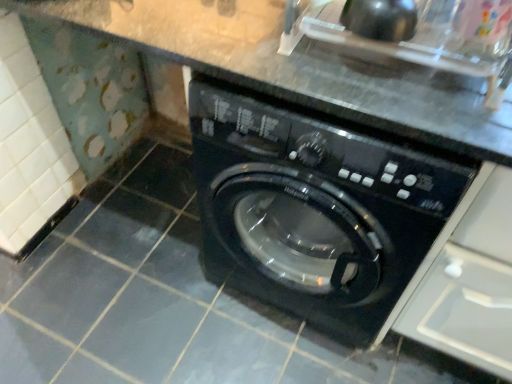
This screenshot has width=512, height=384. What do you see at coordinates (422, 39) in the screenshot? I see `black glossy sink at upper right` at bounding box center [422, 39].

Identify the location of white plastic drawer at upper right. (470, 285).

The width and height of the screenshot is (512, 384). Find the location of `black glossy sink at upper right`. black glossy sink at upper right is located at coordinates (422, 39).

Is point (237, 180) less distant than point (495, 204)?

No, (237, 180) is behind (495, 204).

Which object is positioned more to the left, black glossy washing machine at center or white plastic drawer at upper right?

black glossy washing machine at center is more to the left.

Is black glossy washing machine at center bigger or smaller than white plastic drawer at upper right?

Considering their sizes, black glossy washing machine at center takes up more space than white plastic drawer at upper right.

Can you confirm if black glossy washing machine at center is taller than white plastic drawer at upper right?

In fact, black glossy washing machine at center may be shorter than white plastic drawer at upper right.

Which object is positioned more to the left, white plastic drawer at upper right or black glossy sink at upper right?

From the viewer's perspective, black glossy sink at upper right appears more on the left side.

Is white plastic drawer at upper right situated inside black glossy sink at upper right or outside?

white plastic drawer at upper right is spatially situated outside black glossy sink at upper right.

Who is smaller, white plastic drawer at upper right or black glossy sink at upper right?

black glossy sink at upper right.

From the image's perspective, is white plastic drawer at upper right located above or below black glossy washing machine at center?

white plastic drawer at upper right is below black glossy washing machine at center.

From the picture: Considering the relative sizes of white plastic drawer at upper right and black glossy washing machine at center in the image provided, is white plastic drawer at upper right bigger than black glossy washing machine at center?

No.

Between white plastic drawer at upper right and black glossy washing machine at center, which one has smaller width?

white plastic drawer at upper right is thinner.

Is white plastic drawer at upper right aimed at black glossy washing machine at center?

No.

Which is more to the right, black glossy washing machine at center or black glossy sink at upper right?

Positioned to the right is black glossy sink at upper right.

What are the coordinates of `sink that is in front of the black glossy washing machine at center` in the screenshot? It's located at [x=422, y=39].

From the image's perspective, is black glossy washing machine at center on black glossy sink at upper right?

No, from the image's perspective, black glossy washing machine at center is not above black glossy sink at upper right.

Could you tell me if black glossy washing machine at center is turned towards black glossy sink at upper right?

No, black glossy washing machine at center does not turn towards black glossy sink at upper right.

Between black glossy sink at upper right and black glossy washing machine at center, which one has less height?

black glossy sink at upper right.

In terms of width, does black glossy sink at upper right look wider or thinner when compared to black glossy washing machine at center?

Considering their sizes, black glossy sink at upper right looks slimmer than black glossy washing machine at center.

Between point (498, 47) and point (222, 216), which one is positioned in front?

The point (498, 47) is in front.

Considering the relative sizes of black glossy sink at upper right and white plastic drawer at upper right in the image provided, is black glossy sink at upper right thinner than white plastic drawer at upper right?

Correct, the width of black glossy sink at upper right is less than that of white plastic drawer at upper right.

Is black glossy sink at upper right to the left or to the right of white plastic drawer at upper right in the image?

From the image, it's evident that black glossy sink at upper right is to the left of white plastic drawer at upper right.

Between black glossy sink at upper right and white plastic drawer at upper right, which one has less height?

black glossy sink at upper right is shorter.

Find the location of a particular element. This screenshot has width=512, height=384. sink that is above the white plastic drawer at upper right (from the image's perspective) is located at coordinates tap(422, 39).

Locate an element on the screen. The height and width of the screenshot is (384, 512). washing machine behind the white plastic drawer at upper right is located at coordinates (315, 210).

I want to click on sink that appears above the white plastic drawer at upper right (from a real-world perspective), so click(x=422, y=39).

Considering their positions, is black glossy washing machine at center positioned further to black glossy sink at upper right than white plastic drawer at upper right?

The object further to black glossy sink at upper right is white plastic drawer at upper right.

From the image, which object appears to be farther from white plastic drawer at upper right, black glossy sink at upper right or black glossy washing machine at center?

Based on the image, black glossy sink at upper right appears to be further to white plastic drawer at upper right.

From the image, which object appears to be nearer to black glossy sink at upper right, white plastic drawer at upper right or black glossy washing machine at center?

Among the two, black glossy washing machine at center is located nearer to black glossy sink at upper right.

Looking at the image, which one is located closer to black glossy washing machine at center, white plastic drawer at upper right or black glossy sink at upper right?

Among the two, white plastic drawer at upper right is located nearer to black glossy washing machine at center.

Based on their spatial positions, is black glossy washing machine at center or black glossy sink at upper right further from white plastic drawer at upper right?

The object further to white plastic drawer at upper right is black glossy sink at upper right.

Based on their spatial positions, is black glossy sink at upper right or white plastic drawer at upper right closer to black glossy washing machine at center?

white plastic drawer at upper right is closer to black glossy washing machine at center.

Where is `sink located between black glossy washing machine at center and white plastic drawer at upper right in the left-right direction`? This screenshot has height=384, width=512. sink located between black glossy washing machine at center and white plastic drawer at upper right in the left-right direction is located at coordinates (422, 39).